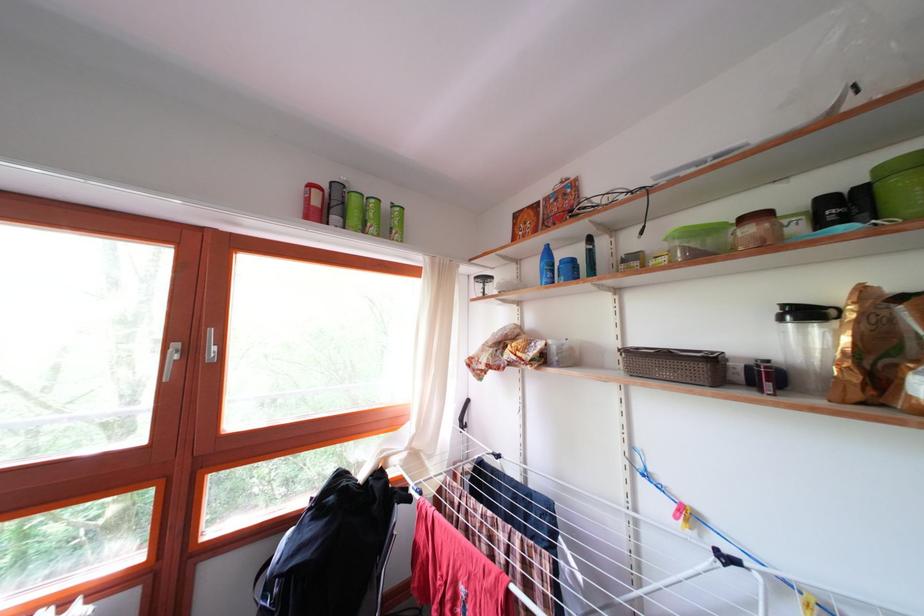
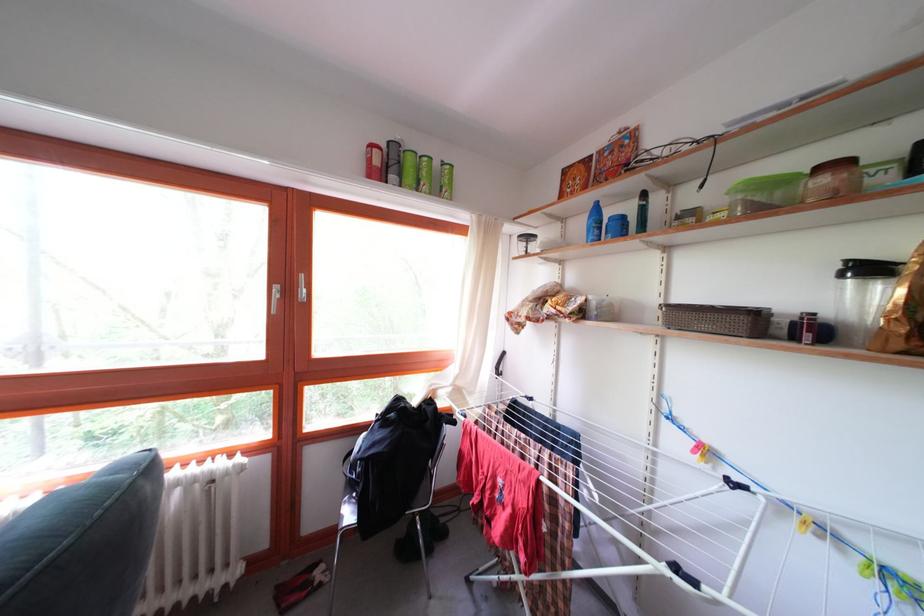
In the second image, find the point that corresponds to (759,236) in the first image.

(832, 187)